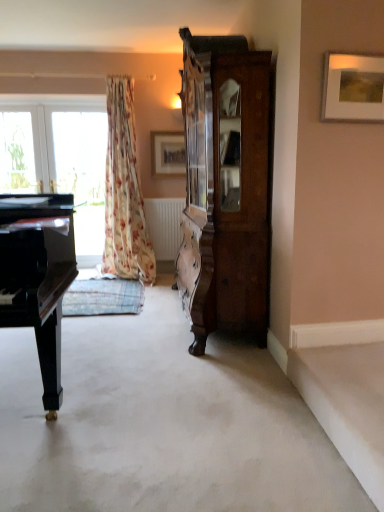
Question: Visually, is transparent glass window at left positioned to the left or to the right of white carpet at center?

Choices:
 (A) right
 (B) left

Answer: (B)

Question: Is point (76, 185) positioned closer to the camera than point (57, 501)?

Choices:
 (A) closer
 (B) farther

Answer: (B)

Question: Which object is the closest to the transparent glass window at left?

Choices:
 (A) floral fabric curtain at left
 (B) white matte radiator at center
 (C) high-gloss black piano at left
 (D) white carpet at center
 (E) transparent glass window at left

Answer: (E)

Question: Estimate the real-world distances between objects in this image. Which object is farther from the wooden picture frame at upper right, arranged as the 2th picture frame when viewed from the left?

Choices:
 (A) high-gloss black piano at left
 (B) dark wood cabinet at right
 (C) white carpet at center
 (D) floral fabric curtain at left
 (E) transparent glass window at left

Answer: (E)